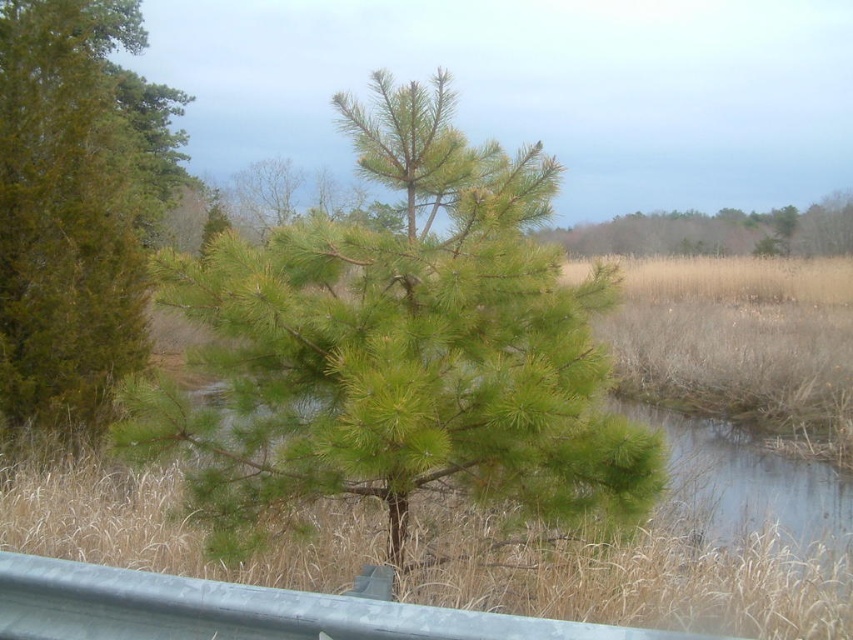
Can you confirm if green needle-like tree at center is positioned to the right of green needle-like at left?

Correct, you'll find green needle-like tree at center to the right of green needle-like at left.

What are the coordinates of `green needle-like tree at center` in the screenshot? It's located at (399, 346).

Is point (553, 433) closer to camera compared to point (42, 413)?

Yes.

I want to click on green needle-like tree at center, so coord(399,346).

Which is below, green needle-like tree at center or green needle-like tree at upper center?

Positioned lower is green needle-like tree at center.

Between point (281, 289) and point (764, 227), which one is positioned in front?

Positioned in front is point (281, 289).

Identify the location of green needle-like tree at center. (399, 346).

Does green needle-like at left have a lesser height compared to green needle-like tree at upper center?

Incorrect, green needle-like at left's height does not fall short of green needle-like tree at upper center's.

Is point (77, 113) closer to viewer compared to point (712, 216)?

Yes, it is in front of point (712, 216).

I want to click on green needle-like at left, so click(67, 211).